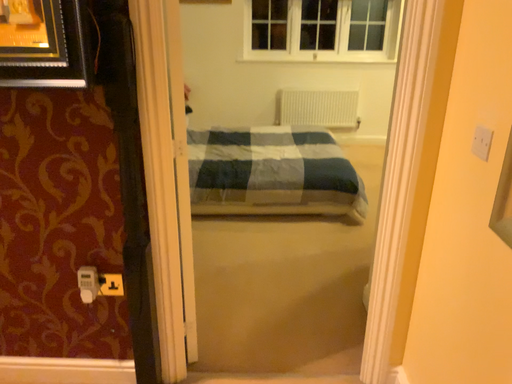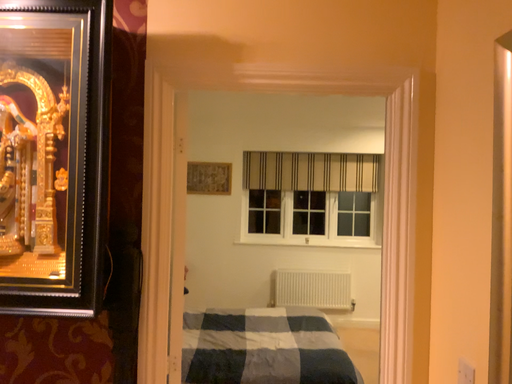
Question: How did the camera likely rotate when shooting the video?

Choices:
 (A) rotated upward
 (B) rotated downward

Answer: (A)